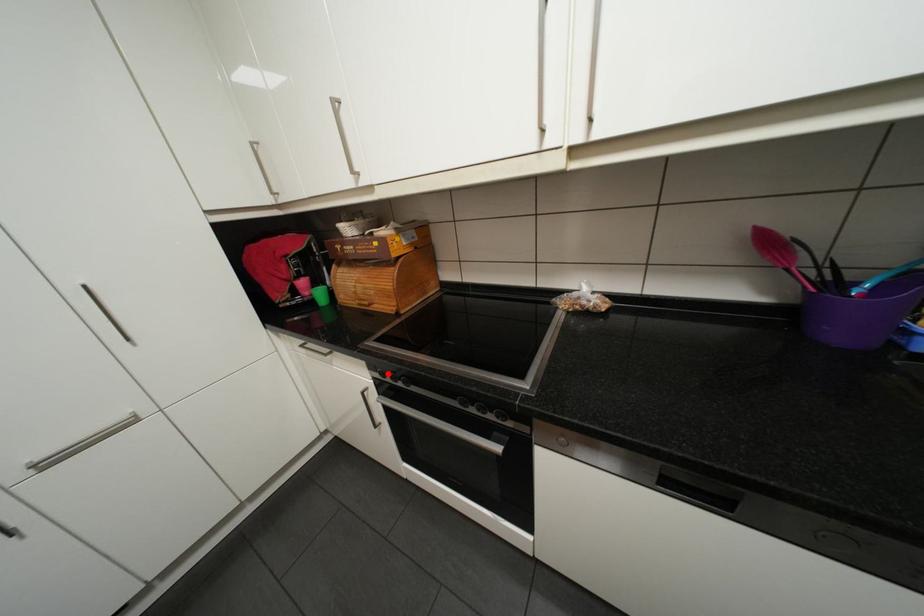
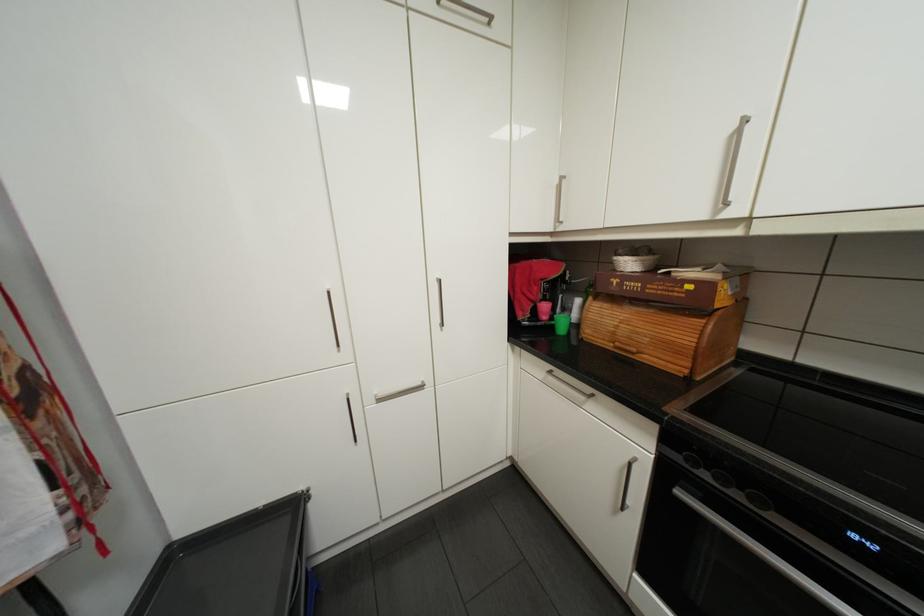
Question: I am providing you with two images of the same scene from different viewpoints. In image1, a red point is highlighted. Considering the same 3D point in image2, which of the following is correct?

Choices:
 (A) It is closer
 (B) It is farther

Answer: (A)